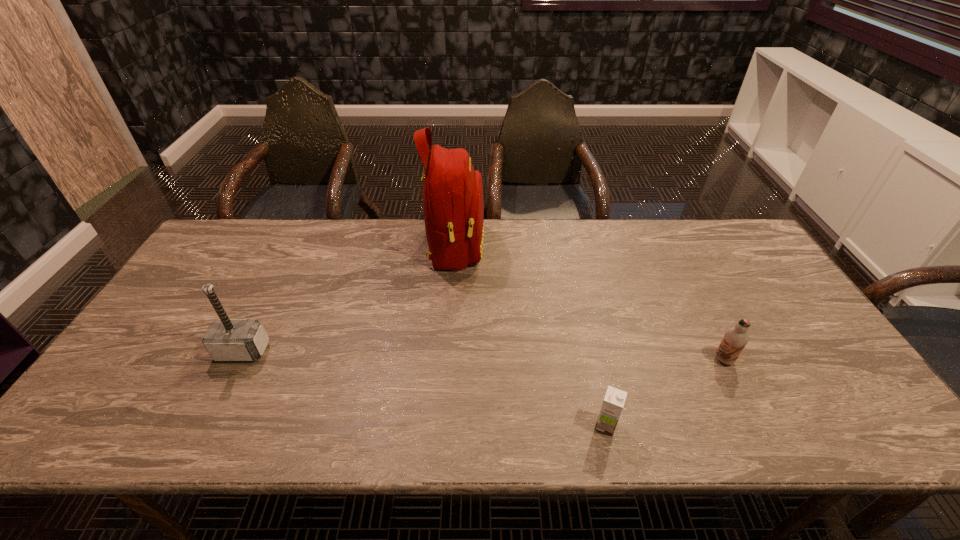
You are a GUI agent. You are given a task and a screenshot of the screen. Output one action in this format:
    pyautogui.click(x=<x>, y=<y>)
    Task: Click on the free space between the backpack and the farther chocolate milk
    Image resolution: width=960 pixels, height=540 pixels.
    Given the screenshot: What is the action you would take?
    pyautogui.click(x=589, y=303)

The width and height of the screenshot is (960, 540). In order to click on object that is the second closest to the shorter chocolate milk in this screenshot , I will do `click(453, 205)`.

Locate an element on the screen. The height and width of the screenshot is (540, 960). object that is the third closest to the third object from right to left is located at coordinates (735, 339).

Where is `free space in the image that satisfies the following two spatial constraints: 1. on the front-facing side of the third object from right to left; 2. on the left side of the left chocolate milk`? free space in the image that satisfies the following two spatial constraints: 1. on the front-facing side of the third object from right to left; 2. on the left side of the left chocolate milk is located at coordinates (443, 426).

You are a GUI agent. You are given a task and a screenshot of the screen. Output one action in this format:
    pyautogui.click(x=<x>, y=<y>)
    Task: Click on the free region that satisfies the following two spatial constraints: 1. on the front-facing side of the tallest object; 2. on the right side of the shortest object
    This screenshot has width=960, height=540.
    Given the screenshot: What is the action you would take?
    pyautogui.click(x=443, y=426)

Find the location of a particular element. The image size is (960, 540). free space in the image that satisfies the following two spatial constraints: 1. for striking with the head of the right chocolate milk; 2. on the right side of the leftmost object is located at coordinates 238,360.

Find the location of a particular element. This screenshot has width=960, height=540. vacant space that satisfies the following two spatial constraints: 1. on the front-facing side of the second object from left to right; 2. for striking with the head of the second tallest object is located at coordinates (447, 351).

The height and width of the screenshot is (540, 960). I want to click on vacant space that satisfies the following two spatial constraints: 1. for striking with the head of the leftmost object; 2. on the right side of the farther chocolate milk, so click(238, 360).

At what (x,y) coordinates should I click in order to perform the action: click on vacant area that satisfies the following two spatial constraints: 1. for striking with the head of the nearest object; 2. on the left side of the leftmost object. Please return your answer as a coordinate pair (x, y). This screenshot has width=960, height=540. Looking at the image, I should click on (204, 426).

This screenshot has height=540, width=960. What are the coordinates of `free space that satisfies the following two spatial constraints: 1. on the front-facing side of the backpack; 2. for striking with the head of the leftmost object` in the screenshot? It's located at (447, 351).